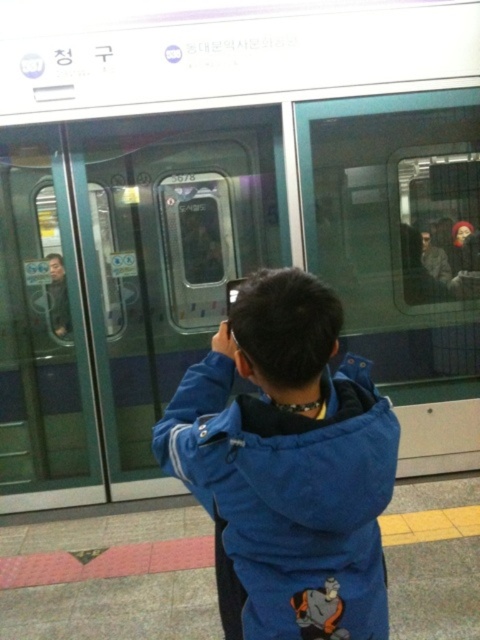
Who is lower down, blue fabric jacket at center or matte black jacket at left?

blue fabric jacket at center is below.

Does blue fabric jacket at center appear on the right side of matte black jacket at left?

Indeed, blue fabric jacket at center is positioned on the right side of matte black jacket at left.

At what (x,y) coordinates should I click in order to perform the action: click on blue fabric jacket at center. Please return your answer as a coordinate pair (x, y). The width and height of the screenshot is (480, 640). Looking at the image, I should click on (288, 465).

Does blue fabric jacket at center appear over black plastic phone at upper center?

No.

How far apart are blue fabric jacket at center and black plastic phone at upper center?

9.46 feet

Does point (264, 516) lie in front of point (229, 300)?

Yes, point (264, 516) is in front of point (229, 300).

Where is `blue fabric jacket at center`? This screenshot has width=480, height=640. blue fabric jacket at center is located at coordinates (288, 465).

Which is in front, point (52, 324) or point (228, 292)?

Point (228, 292) is more forward.

Is point (50, 316) behind point (242, 282)?

Yes, point (50, 316) is behind point (242, 282).

You are a GUI agent. You are given a task and a screenshot of the screen. Output one action in this format:
    pyautogui.click(x=<x>, y=<y>)
    Task: Click on the matte black jacket at left
    
    Given the screenshot: What is the action you would take?
    pyautogui.click(x=58, y=296)